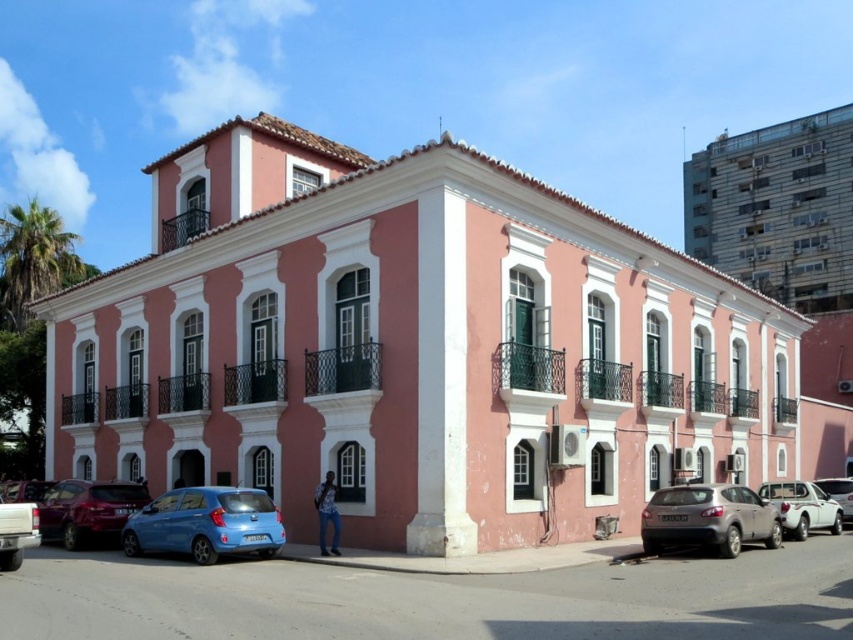
You are a delivery person trying to park your van next to the white glossy sedan at center. The van is 12 meters long. Is there enough space between the satin silver suv at lower right and the building to park your van?

The satin silver suv at lower right is 11.81 meters from the white glossy sedan at center. Since the van is 12 meters long, there is not enough space between the satin silver suv at lower right and the building to park the van.

You are standing in front of the building and notice two points marked on the facade. The first point is at coordinates point (834, 509) and the second is at point (846, 506). Which of these points is closer to you?

Point (834, 509) is closer to the camera than point (846, 506).